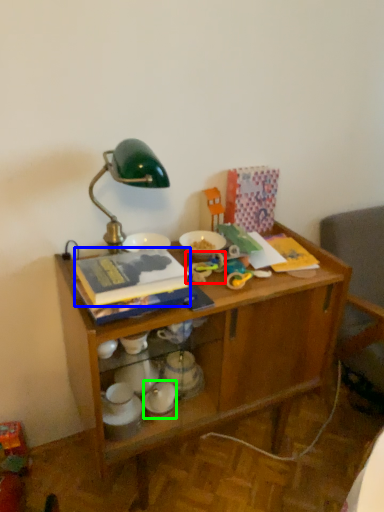
Question: Based on their relative distances, which object is nearer to toy (highlighted by a red box)? Choose from paperback book (highlighted by a blue box) and tableware (highlighted by a green box).

Choices:
 (A) paperback book
 (B) tableware

Answer: (A)